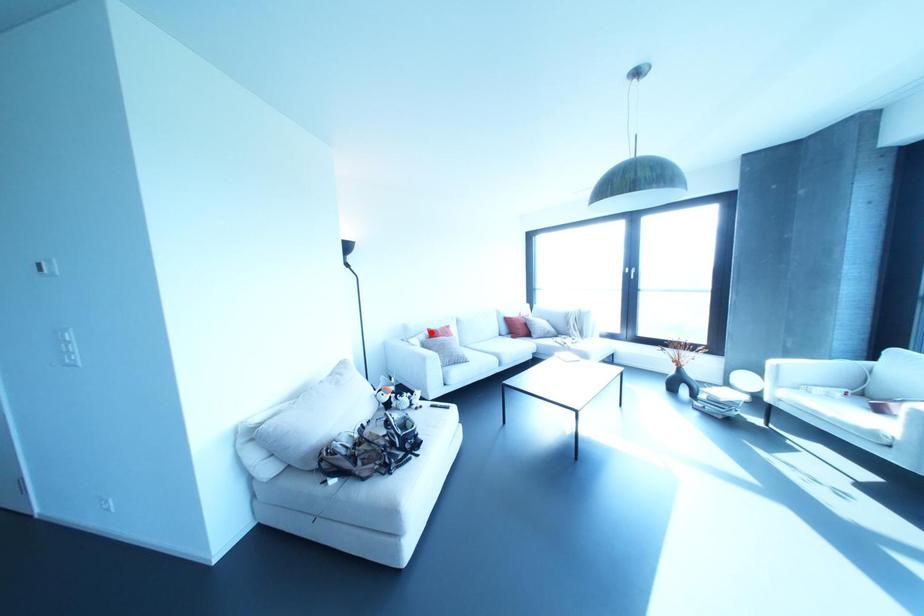
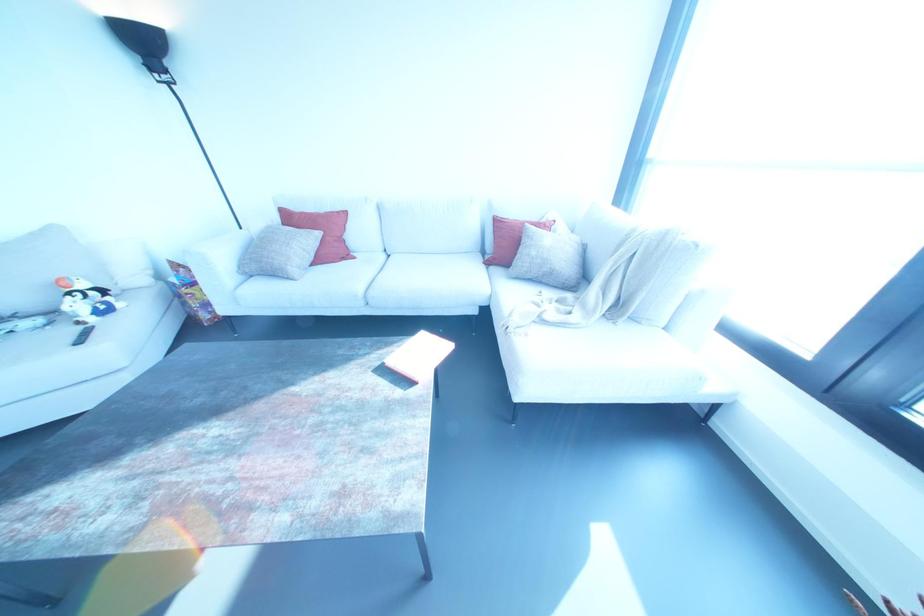
Question: I am providing you with two images of the same scene from different viewpoints. In image1, a red point is highlighted. Considering the same 3D point in image2, which of the following is correct?

Choices:
 (A) It is closer
 (B) It is farther

Answer: (A)